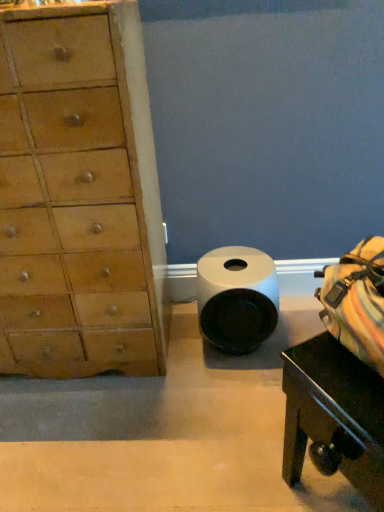
This screenshot has height=512, width=384. What are the coordinates of `white matte toilet paper at center` in the screenshot? It's located at (237, 298).

What is the approximate width of light brown wood chest of drawers at left?

15.24 inches.

Identify the location of white matte toilet paper at center. Image resolution: width=384 pixels, height=512 pixels. (237, 298).

Is the position of light brown wood chest of drawers at left less distant than that of white matte toilet paper at center?

Yes, light brown wood chest of drawers at left is closer to the viewer.

You are a GUI agent. You are given a task and a screenshot of the screen. Output one action in this format:
    pyautogui.click(x=<x>, y=<y>)
    Task: Click on the chest of drawers that appears in front of the white matte toilet paper at center
    The image size is (384, 512).
    Given the screenshot: What is the action you would take?
    pyautogui.click(x=76, y=201)

Is point (8, 215) farther from camera compared to point (217, 308)?

No, it is in front of (217, 308).

Is white matte toilet paper at center at the right side of light brown wood chest of drawers at left?

Yes.

Considering the sizes of objects white matte toilet paper at center and light brown wood chest of drawers at left in the image provided, who is thinner, white matte toilet paper at center or light brown wood chest of drawers at left?

With smaller width is white matte toilet paper at center.

How distant is white matte toilet paper at center from light brown wood chest of drawers at left?

white matte toilet paper at center and light brown wood chest of drawers at left are 15.47 inches apart.

From the image's perspective, between black glossy table at lower right and light brown wood chest of drawers at left, who is located below?

black glossy table at lower right is shown below in the image.

Does black glossy table at lower right have a greater width compared to light brown wood chest of drawers at left?

No.

Which of these two, black glossy table at lower right or light brown wood chest of drawers at left, is bigger?

light brown wood chest of drawers at left.

Does black glossy table at lower right contain light brown wood chest of drawers at left?

No, black glossy table at lower right does not contain light brown wood chest of drawers at left.

Is there a large distance between white matte toilet paper at center and black glossy table at lower right?

That's not correct — white matte toilet paper at center is a little close to black glossy table at lower right.

Is white matte toilet paper at center aimed at black glossy table at lower right?

No, white matte toilet paper at center is not aimed at black glossy table at lower right.

Is point (202, 301) farther from viewer compared to point (306, 403)?

Yes, point (202, 301) is farther from viewer.

Is white matte toilet paper at center positioned in front of black glossy table at lower right?

No.

Which is less distant, [378,418] or [268,306]?

Point [378,418] is positioned closer to the camera compared to point [268,306].

From a real-world perspective, is black glossy table at lower right positioned over white matte toilet paper at center based on gravity?

Indeed, from a real-world perspective, black glossy table at lower right stands above white matte toilet paper at center.

Who is bigger, black glossy table at lower right or white matte toilet paper at center?

Bigger between the two is black glossy table at lower right.

Is black glossy table at lower right thinner than white matte toilet paper at center?

In fact, black glossy table at lower right might be wider than white matte toilet paper at center.

From a real-world perspective, is light brown wood chest of drawers at left located higher than black glossy table at lower right?

Yes, from a real-world perspective, light brown wood chest of drawers at left is on top of black glossy table at lower right.

Does light brown wood chest of drawers at left have a larger size compared to black glossy table at lower right?

Yes, light brown wood chest of drawers at left is bigger than black glossy table at lower right.

Is point (35, 310) positioned after point (312, 459)?

Yes, point (35, 310) is farther from viewer.

Does light brown wood chest of drawers at left have a greater width compared to black glossy table at lower right?

Yes, light brown wood chest of drawers at left is wider than black glossy table at lower right.

Where is `chest of drawers on the left of white matte toilet paper at center`? This screenshot has width=384, height=512. chest of drawers on the left of white matte toilet paper at center is located at coordinates [x=76, y=201].

I want to click on toilet paper below the light brown wood chest of drawers at left (from a real-world perspective), so point(237,298).

From the image, which object appears to be nearer to white matte toilet paper at center, light brown wood chest of drawers at left or black glossy table at lower right?

light brown wood chest of drawers at left is positioned closer to the anchor white matte toilet paper at center.

From the image, which object appears to be nearer to black glossy table at lower right, white matte toilet paper at center or light brown wood chest of drawers at left?

white matte toilet paper at center is closer to black glossy table at lower right.

Based on the photo, considering their positions, is white matte toilet paper at center positioned closer to light brown wood chest of drawers at left than black glossy table at lower right?

white matte toilet paper at center lies closer to light brown wood chest of drawers at left than the other object.

From the image, which object appears to be farther from white matte toilet paper at center, black glossy table at lower right or light brown wood chest of drawers at left?

black glossy table at lower right lies further to white matte toilet paper at center than the other object.

Considering their positions, is light brown wood chest of drawers at left positioned closer to black glossy table at lower right than white matte toilet paper at center?

→ white matte toilet paper at center is positioned closer to the anchor black glossy table at lower right.

From the image, which object appears to be nearer to light brown wood chest of drawers at left, black glossy table at lower right or white matte toilet paper at center?

white matte toilet paper at center is positioned closer to the anchor light brown wood chest of drawers at left.

Locate an element on the screen. Image resolution: width=384 pixels, height=512 pixels. toilet paper between light brown wood chest of drawers at left and black glossy table at lower right from left to right is located at coordinates (237, 298).